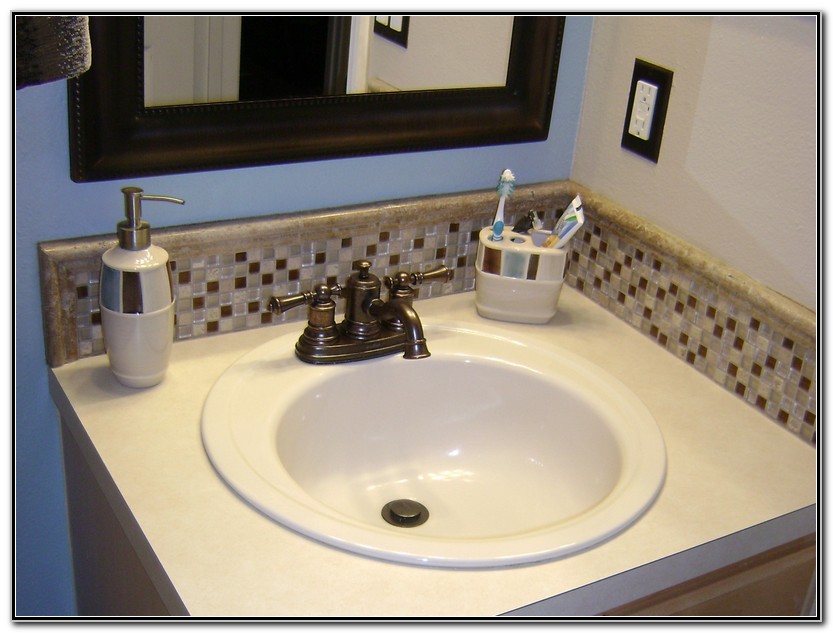
In order to click on blue wall background in this screenshot , I will do `click(23, 379)`.